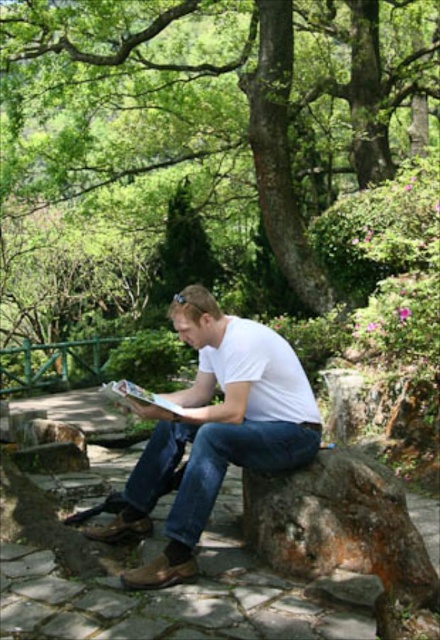
In the scene shown: Can you confirm if green leafy tree at center is smaller than white matte t-shirt at center?

No.

Is point (336, 120) farther from camera compared to point (294, 365)?

That is True.

Is point (80, 54) less distant than point (228, 364)?

No, it is behind (228, 364).

The image size is (440, 640). Find the location of `green leafy tree at center`. green leafy tree at center is located at coordinates (205, 120).

Between white cotton shirt at center and blue denim jeans at center, which one is positioned higher?

white cotton shirt at center is above.

Which of these two, white cotton shirt at center or blue denim jeans at center, stands shorter?

Standing shorter between the two is blue denim jeans at center.

This screenshot has width=440, height=640. I want to click on white cotton shirt at center, so (x=215, y=429).

Does green leafy tree at center have a greater width compared to blue denim jeans at center?

Correct, the width of green leafy tree at center exceeds that of blue denim jeans at center.

Who is more forward, (330, 108) or (267, 449)?

Point (267, 449)

Is point (29, 241) more distant than point (195, 444)?

Yes, point (29, 241) is farther from viewer.

Locate an element on the screen. This screenshot has height=640, width=440. green leafy tree at center is located at coordinates (205, 120).